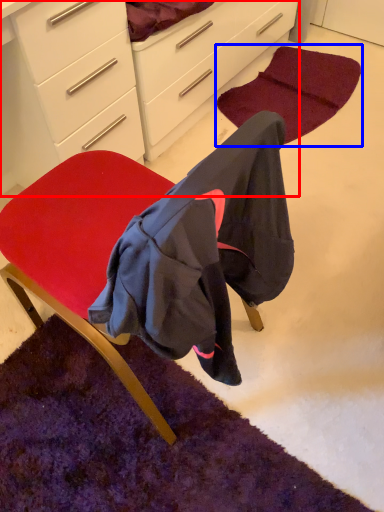
Question: Which point is further to the camera, cabinetry (highlighted by a red box) or mat (highlighted by a blue box)?

Choices:
 (A) cabinetry
 (B) mat

Answer: (B)